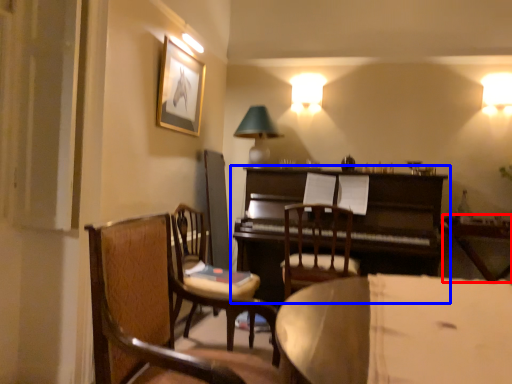
Question: Among these objects, which one is nearest to the camera, table (highlighted by a red box) or piano (highlighted by a blue box)?

Choices:
 (A) table
 (B) piano

Answer: (A)